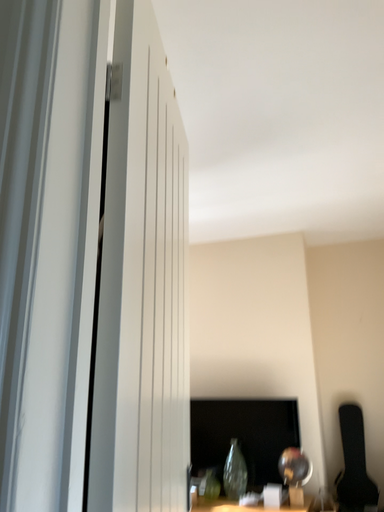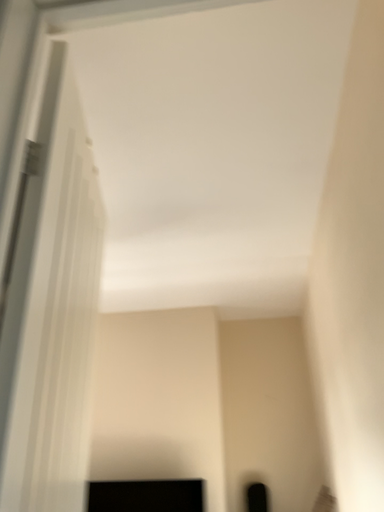
Question: Which way did the camera rotate in the video?

Choices:
 (A) rotated upward
 (B) rotated downward

Answer: (A)